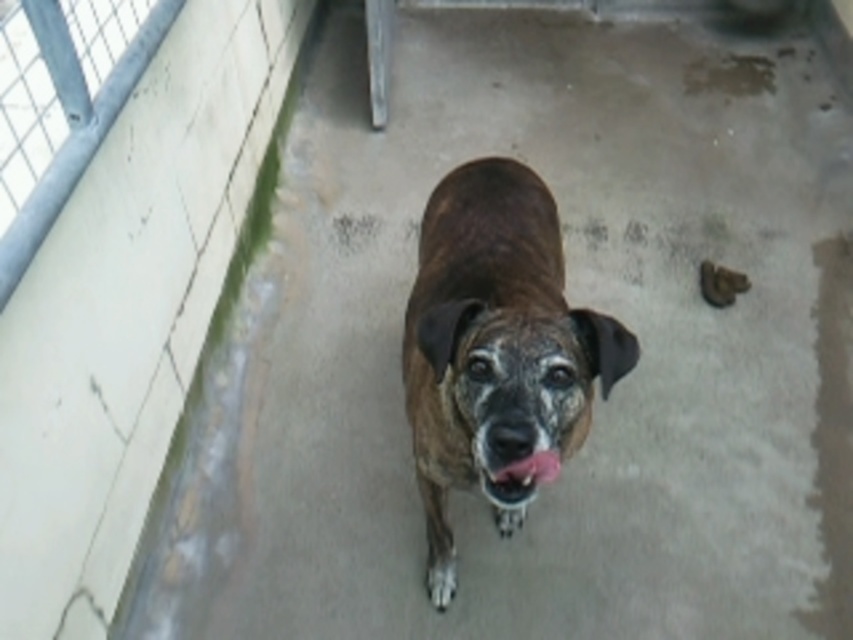
You are a veterinarian examining a dog in an enclosed area. The dog is standing on a concrete floor with a point marked at coordinates (495, 348). Where is this point located on the dog?

The point at coordinates (495, 348) is located on the brown fur dog at center.

You are a veterinarian examining a dog in an enclosed area. The dog has a brown fur dog at center and a pink glossy tongue at center. You need to determine if the distance between these two parts is sufficient for you to safely administer a subcutaneous injection. The minimum required distance for the injection is 40 centimeters. Can you proceed?

The distance between the brown fur dog at center and the pink glossy tongue at center is 39.02 centimeters, which is less than the required 40 centimeters. Therefore, you cannot safely administer the subcutaneous injection at this time.

You are a delivery robot positioned at point (544,468) and need to deliver a package to point (491,234). According to the scene, can you move directly towards the destination without any obstacles?

Point (491,234) is behind point (544,468), so you cannot move directly towards the destination without encountering an obstacle.